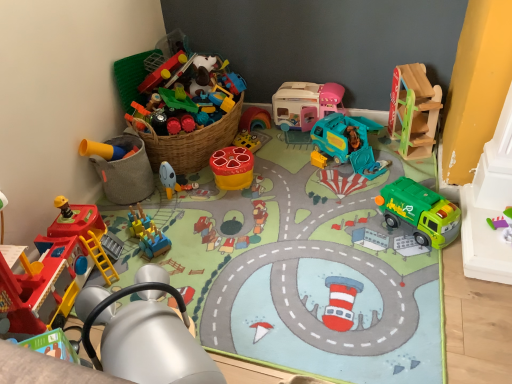
Locate an element on the screen. vacant space to the left of teal plastic garbage truck at center, marked as the 3th toy in a right-to-left arrangement is located at coordinates (285, 161).